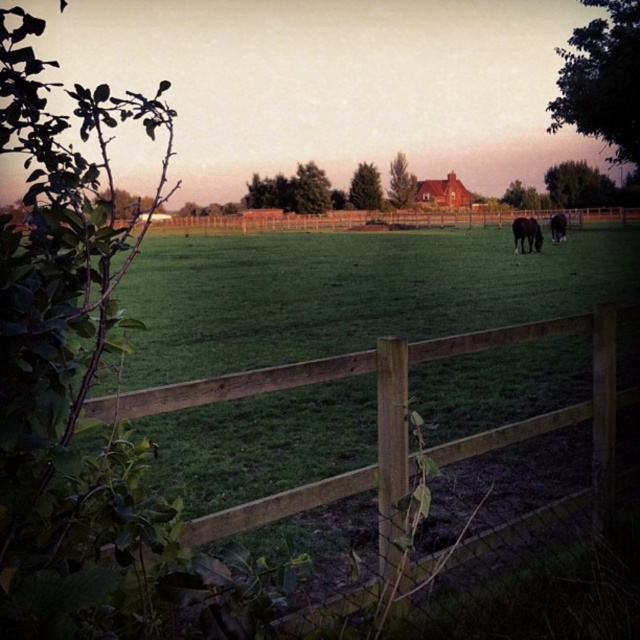
Question: Does wooden fence at lower center lie in front of brown glossy horse at center-right?

Choices:
 (A) yes
 (B) no

Answer: (A)

Question: Can you confirm if wooden fence at lower center is positioned to the left of brown glossy horse at center-right?

Choices:
 (A) yes
 (B) no

Answer: (A)

Question: Can you confirm if brown glossy horse at center-right is thinner than black glossy horse at center?

Choices:
 (A) no
 (B) yes

Answer: (B)

Question: Which point is farther from the camera taking this photo?

Choices:
 (A) (225, 520)
 (B) (518, 246)

Answer: (B)

Question: Which point is farther to the camera?

Choices:
 (A) (564, 227)
 (B) (516, 225)
 (C) (237, 508)

Answer: (A)

Question: Which of the following is the farthest from the observer?

Choices:
 (A) (554, 224)
 (B) (360, 481)
 (C) (540, 237)

Answer: (A)